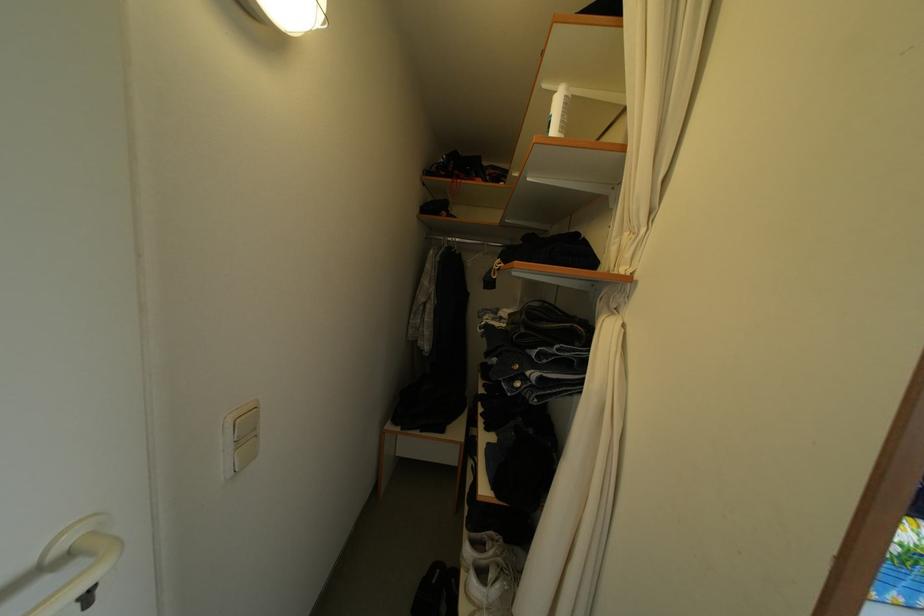
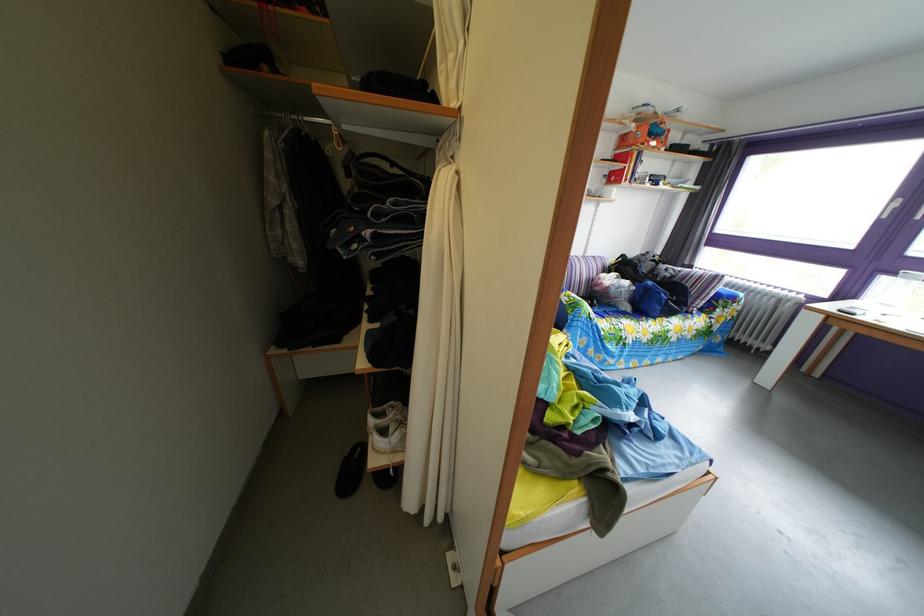
Locate, in the second image, the point that corresponds to point (601, 355) in the first image.

(438, 207)